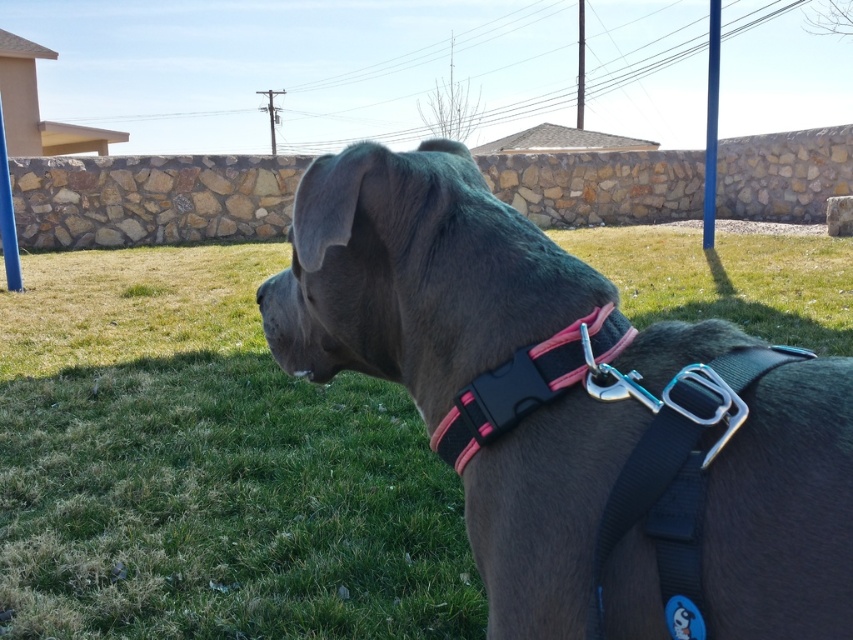
Question: Can you confirm if matte gray dog at center is bigger than pink matte plastic collar at center?

Choices:
 (A) yes
 (B) no

Answer: (A)

Question: Among these objects, which one is nearest to the camera?

Choices:
 (A) pink matte plastic collar at center
 (B) matte gray dog at center

Answer: (B)

Question: Which of the following is the farthest from the observer?

Choices:
 (A) matte gray dog at center
 (B) pink matte plastic collar at center

Answer: (B)

Question: Is the position of matte gray dog at center more distant than that of pink matte plastic collar at center?

Choices:
 (A) yes
 (B) no

Answer: (B)

Question: Among these points, which one is farthest from the camera?

Choices:
 (A) (570, 408)
 (B) (495, 378)

Answer: (B)

Question: Does matte gray dog at center have a lesser width compared to pink matte plastic collar at center?

Choices:
 (A) yes
 (B) no

Answer: (B)